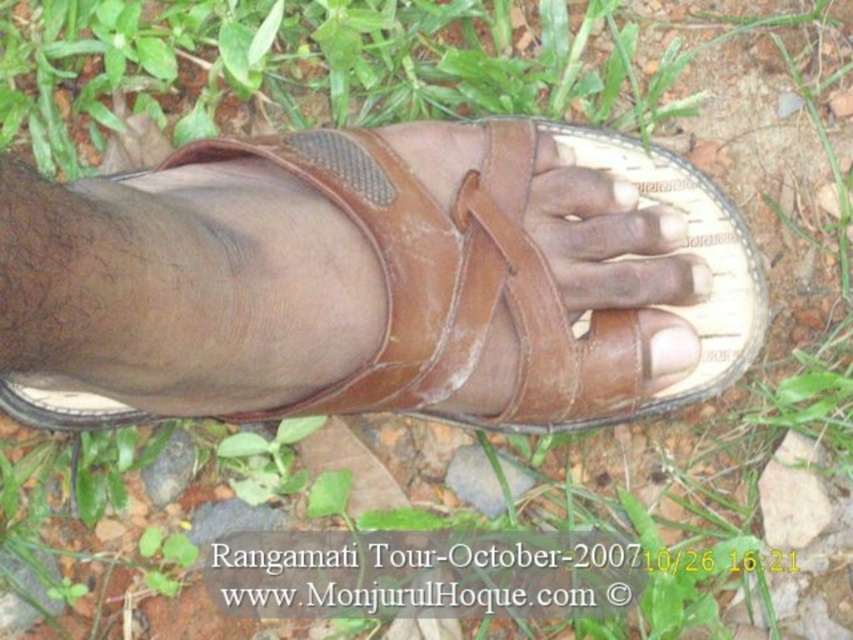
Question: Which of the following is the farthest from the observer?

Choices:
 (A) matte brown toe at center
 (B) brown leather sandal at center

Answer: (B)

Question: Is brown leather sandal at center wider than matte brown toe at center?

Choices:
 (A) no
 (B) yes

Answer: (B)

Question: In this image, where is brown leather sandal at center located relative to matte brown toe at center?

Choices:
 (A) below
 (B) above

Answer: (B)

Question: From the image, what is the correct spatial relationship of brown leather sandal at center in relation to matte brown toe at center?

Choices:
 (A) left
 (B) right

Answer: (A)

Question: Which object appears closest to the camera in this image?

Choices:
 (A) matte brown toe at center
 (B) brown leather sandal at center

Answer: (A)

Question: Which point is farther to the camera?

Choices:
 (A) brown leather sandal at center
 (B) matte brown toe at center

Answer: (A)